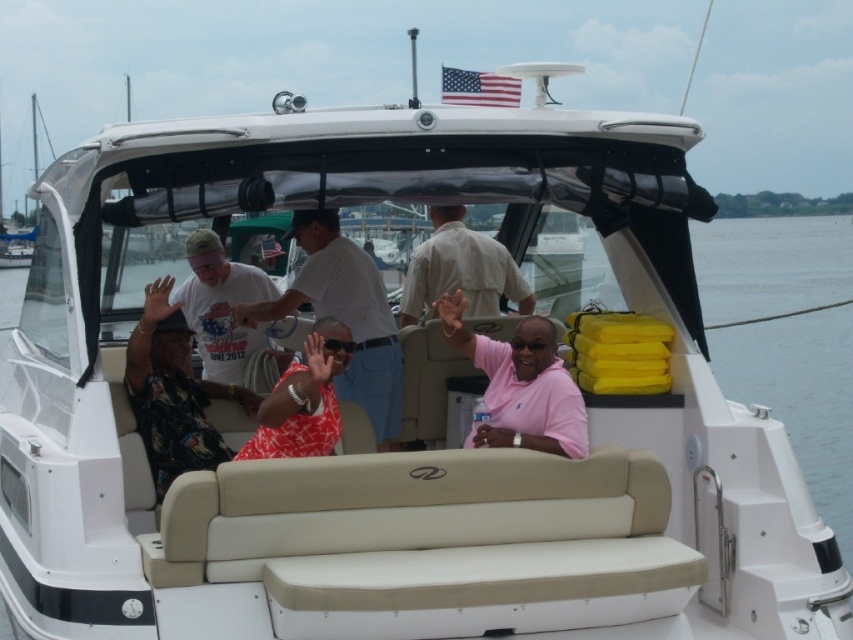
Question: Observing the image, what is the correct spatial positioning of pink matte shirt at center in reference to light beige cotton shirt at center?

Choices:
 (A) left
 (B) right

Answer: (B)

Question: Can you confirm if white t-shirt at center is positioned below red printed shirt at center?

Choices:
 (A) yes
 (B) no

Answer: (B)

Question: Is white cotton shirt at center to the right of pink matte shirt at center from the viewer's perspective?

Choices:
 (A) yes
 (B) no

Answer: (B)

Question: Which object is farther from the camera taking this photo?

Choices:
 (A) pink matte shirt at center
 (B) white t-shirt at center
 (C) light beige cotton shirt at center

Answer: (C)

Question: Which point is closer to the camera?

Choices:
 (A) light beige cotton shirt at center
 (B) printed fabric shirt at left
 (C) yellow foam at right
 (D) white cotton shirt at center

Answer: (B)

Question: Which object appears farthest from the camera in this image?

Choices:
 (A) pink matte shirt at center
 (B) white t-shirt at center
 (C) red printed shirt at center

Answer: (B)